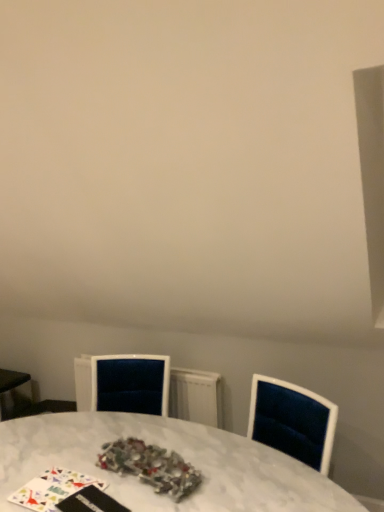
This screenshot has width=384, height=512. What are the coordinates of `free space on the front side of shiny metallic tinsel at center` in the screenshot? It's located at (140, 495).